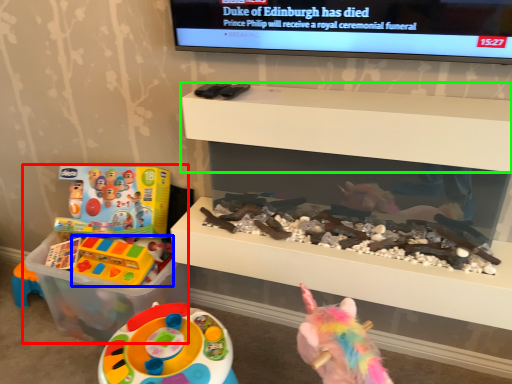
Question: Which object is the farthest from toy (highlighted by a red box)? Choose among these: toy (highlighted by a blue box) or shelf (highlighted by a green box).

Choices:
 (A) toy
 (B) shelf

Answer: (B)